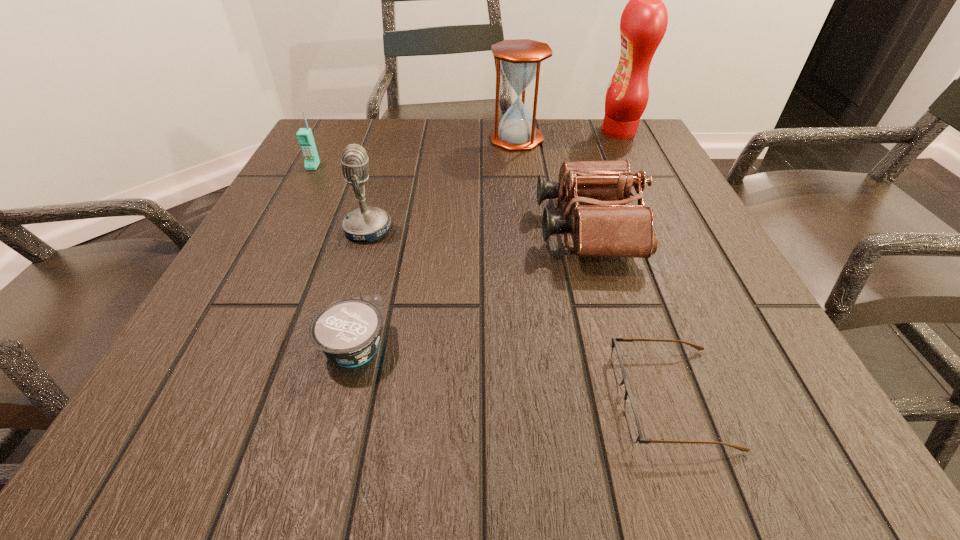
Identify the location of free region located on the front-facing side of the shortest object. (355, 397).

Where is `condiment situated at the far edge`? The height and width of the screenshot is (540, 960). condiment situated at the far edge is located at coordinates (643, 24).

Locate an element on the screen. This screenshot has height=540, width=960. hourglass present at the far edge is located at coordinates (520, 59).

Locate an element on the screen. This screenshot has height=540, width=960. cellular telephone located in the far edge section of the desktop is located at coordinates (305, 138).

Locate an element on the screen. object at the near edge is located at coordinates (631, 415).

Identify the location of object that is at the left edge. Image resolution: width=960 pixels, height=540 pixels. (305, 138).

The image size is (960, 540). Identify the location of condiment that is at the right edge. (643, 24).

What are the coordinates of `binoculars located in the right edge section of the desktop` in the screenshot? It's located at (609, 228).

The width and height of the screenshot is (960, 540). Find the location of `spectacles present at the right edge`. spectacles present at the right edge is located at coordinates (631, 415).

You are a GUI agent. You are given a task and a screenshot of the screen. Output one action in this format:
    pyautogui.click(x=<x>, y=<y>)
    Task: Click on the object at the far left corner
    The image size is (960, 540).
    Given the screenshot: What is the action you would take?
    pyautogui.click(x=305, y=138)